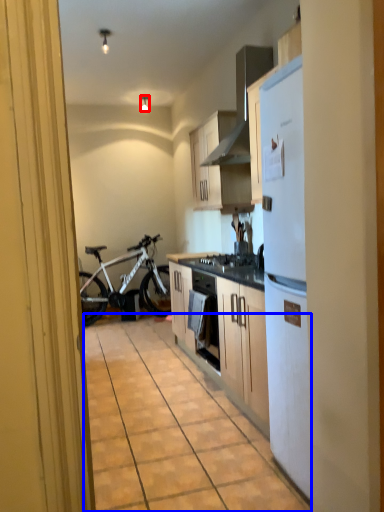
Question: Among these objects, which one is farthest to the camera, lamp (highlighted by a red box) or alley (highlighted by a blue box)?

Choices:
 (A) lamp
 (B) alley

Answer: (A)